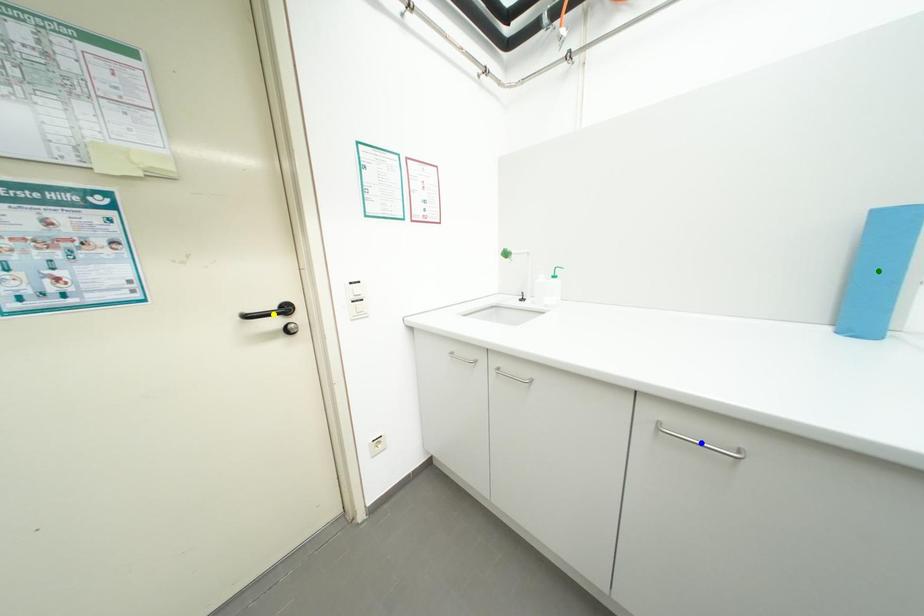
Order these from nearest to farthest:
- green point
- blue point
- yellow point

blue point, green point, yellow point